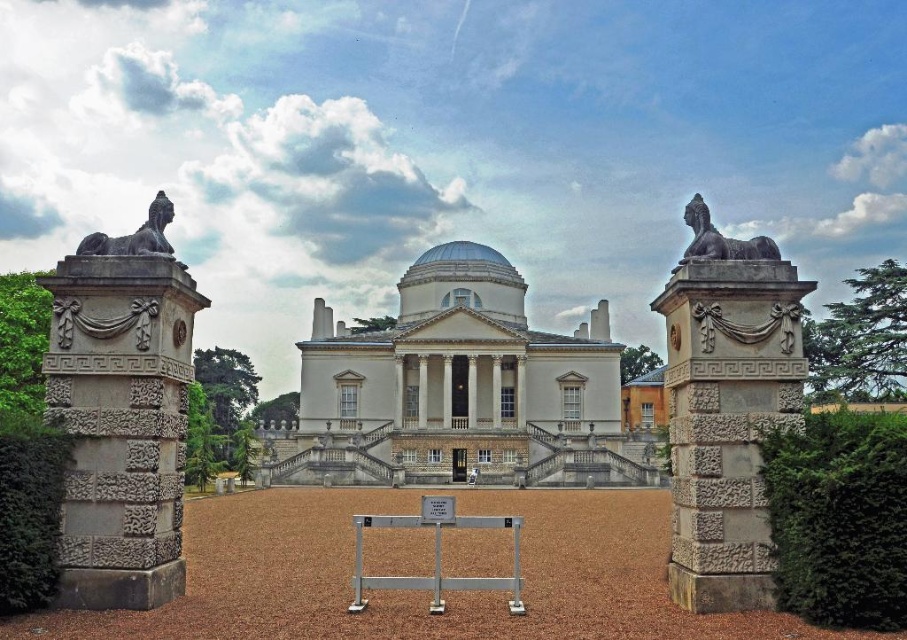
Is polished bronze sphinx at upper right further to the viewer compared to polished bronze sphinx at left?

No, polished bronze sphinx at upper right is closer to the viewer.

What do you see at coordinates (720, 237) in the screenshot? The width and height of the screenshot is (907, 640). I see `polished bronze sphinx at upper right` at bounding box center [720, 237].

Is point (686, 205) closer to viewer compared to point (86, 237)?

No, it is not.

The width and height of the screenshot is (907, 640). I want to click on polished bronze sphinx at upper right, so click(x=720, y=237).

Which of these two, green leafy hedge at left or polished bronze sphinx at upper right, stands shorter?

Standing shorter between the two is green leafy hedge at left.

Does green leafy hedge at left appear over polished bronze sphinx at upper right?

Incorrect, green leafy hedge at left is not positioned above polished bronze sphinx at upper right.

Which is in front, point (26, 544) or point (689, 259)?

Point (26, 544) is more forward.

Locate an element on the screen. The width and height of the screenshot is (907, 640). green leafy hedge at left is located at coordinates (28, 509).

What do you see at coordinates (457, 388) in the screenshot? The image size is (907, 640). I see `white stone mansion at center` at bounding box center [457, 388].

Does point (310, 385) lie in front of point (699, 234)?

No, (310, 385) is further to viewer.

Find the location of a particular element. This screenshot has width=907, height=640. white stone mansion at center is located at coordinates (457, 388).